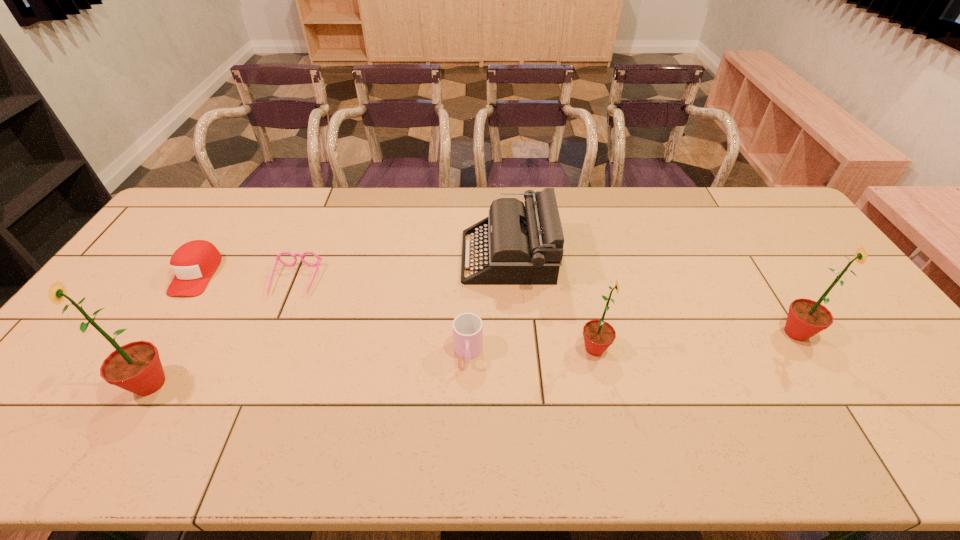
I want to click on sunflower that is the closest to the shortest sunflower, so click(806, 318).

Identify the location of sunflower that is the second closest one to the spectacles. This screenshot has width=960, height=540. (598, 335).

You are a GUI agent. You are given a task and a screenshot of the screen. Output one action in this format:
    pyautogui.click(x=<x>, y=<y>)
    Task: Click on the blank space that satisfies the following two spatial constraints: 1. on the typing side of the fourth tallest object; 2. with the handle on the side of the cup
    This screenshot has height=540, width=960.
    Given the screenshot: What is the action you would take?
    pyautogui.click(x=515, y=353)

You are a GUI agent. You are given a task and a screenshot of the screen. Output one action in this format:
    pyautogui.click(x=<x>, y=<y>)
    Task: Click on the vacant region that satisfies the following two spatial constraints: 1. on the face of the second sunflower from right to left; 2. with the handle on the side of the cup
    
    Given the screenshot: What is the action you would take?
    click(x=595, y=353)

Where is `free space that satisfies the following two spatial constraints: 1. on the typing side of the fourth tallest object; 2. with the handle on the side of the cup`? This screenshot has width=960, height=540. free space that satisfies the following two spatial constraints: 1. on the typing side of the fourth tallest object; 2. with the handle on the side of the cup is located at coordinates (515, 353).